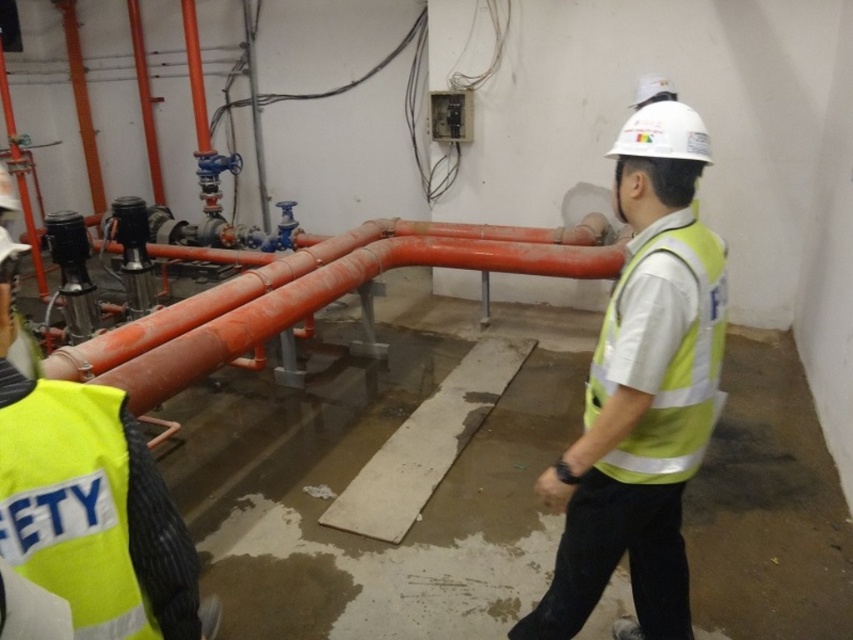
How far apart are yellow reflective safety vest at lower left and yellow reflective safety vest at center?

The distance of yellow reflective safety vest at lower left from yellow reflective safety vest at center is 3.48 feet.

Is point (99, 388) closer to viewer compared to point (596, 346)?

Yes, point (99, 388) is closer to viewer.

Does point (146, 508) come farther from viewer compared to point (679, 378)?

No, it is in front of (679, 378).

Image resolution: width=853 pixels, height=640 pixels. I want to click on yellow reflective safety vest at lower left, so click(x=80, y=506).

Who is taller, yellow reflective vest at center or yellow reflective safety vest at lower left?

yellow reflective vest at center

Is point (614, 307) more distant than point (160, 544)?

Yes, it is.

Find the location of a particular element. The width and height of the screenshot is (853, 640). yellow reflective vest at center is located at coordinates (642, 394).

Between orange matte pipes at center and yellow reflective safety vest at center, which one is positioned lower?

yellow reflective safety vest at center is lower down.

Who is higher up, orange matte pipes at center or yellow reflective safety vest at center?

orange matte pipes at center is higher up.

Measure the distance between point (x=384, y=268) and camera.

Point (x=384, y=268) and camera are 13.19 feet apart.

I want to click on orange matte pipes at center, so click(300, 307).